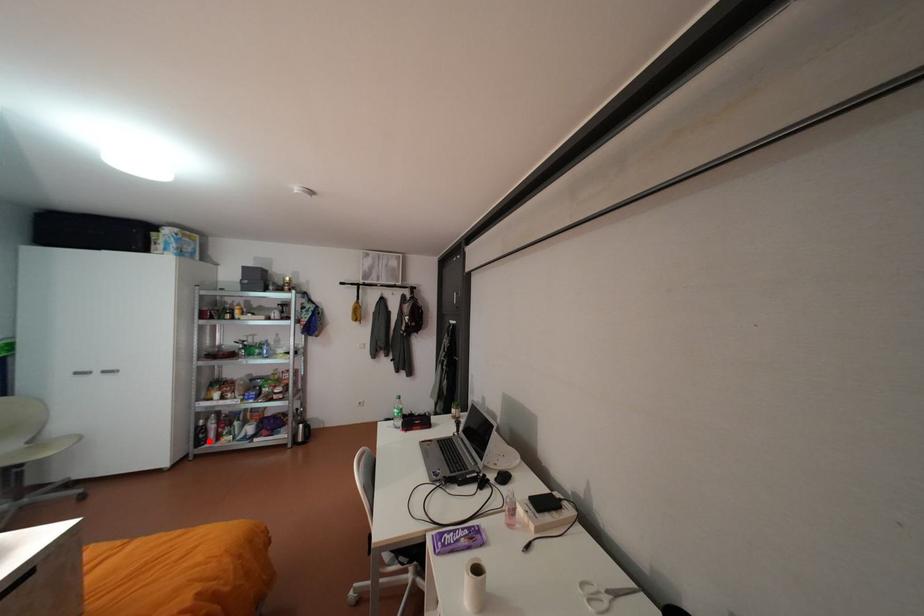
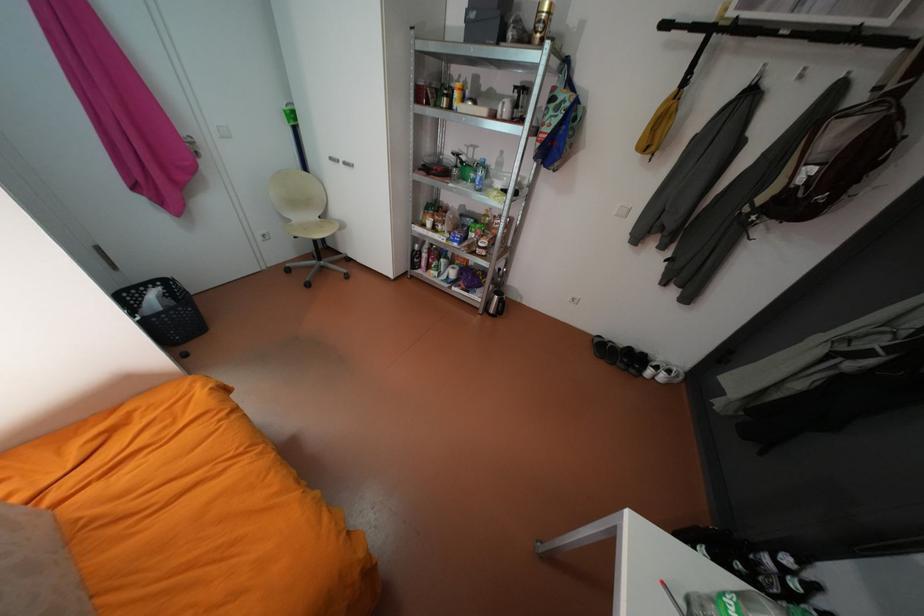
Question: I am providing you with two images of the same scene from different viewpoints. In image1, a red point is highlighted. Considering the same 3D point in image2, which of the following is correct?

Choices:
 (A) It is closer
 (B) It is farther

Answer: (A)